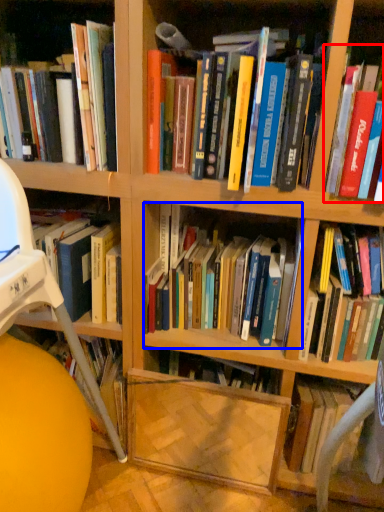
Question: Which point is further to the camera, book (highlighted by a red box) or book (highlighted by a blue box)?

Choices:
 (A) book
 (B) book

Answer: (B)